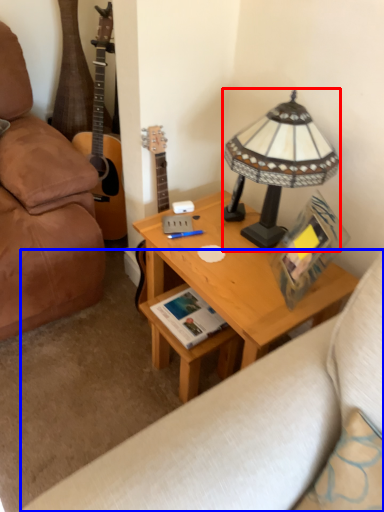
Question: Which of the following is the farthest to the observer, lamp (highlighted by a red box) or studio couch (highlighted by a blue box)?

Choices:
 (A) lamp
 (B) studio couch

Answer: (B)